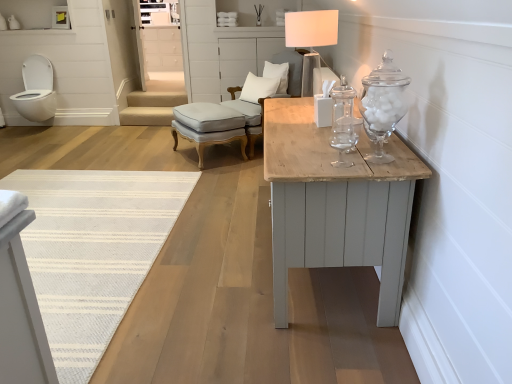
What do you see at coordinates (162, 49) in the screenshot? The image size is (512, 384). I see `white painted wood drawer at upper center` at bounding box center [162, 49].

Locate an element on the screen. This screenshot has width=512, height=384. light gray fabric armchair at center is located at coordinates (229, 128).

The width and height of the screenshot is (512, 384). Describe the element at coordinates (229, 128) in the screenshot. I see `light gray fabric armchair at center` at that location.

This screenshot has height=384, width=512. I want to click on white soft pillow at upper center, marked as the second pillow in a bottom-to-top arrangement, so click(277, 75).

Find the location of a particular element. light gray fabric stool at center is located at coordinates (208, 126).

Is light gray fabric armchair at center bigger or smaller than white fabric lampshade at upper center?

Clearly, light gray fabric armchair at center is larger in size than white fabric lampshade at upper center.

Would you say light gray fabric armchair at center is a long distance from white fabric lampshade at upper center?

light gray fabric armchair at center is positioned a significant distance from white fabric lampshade at upper center.

Considering the positions of objects light gray fabric armchair at center and white fabric lampshade at upper center in the image provided, who is more to the right, light gray fabric armchair at center or white fabric lampshade at upper center?

white fabric lampshade at upper center.

Is point (180, 113) closer or farther from the camera than point (300, 34)?

Point (180, 113).

Looking at this image, are white painted wood drawer at upper center and white glossy toilet at left far apart?

Yes, white painted wood drawer at upper center is far from white glossy toilet at left.

Is white painted wood drawer at upper center facing away from white glossy toilet at left?

No.

Consider the image. Does white painted wood drawer at upper center have a smaller size compared to white glossy toilet at left?

No.

From a real-world perspective, is white painted wood drawer at upper center beneath white glossy toilet at left?

No.

Do you think white painted wood drawer at upper center is within white cotton pillow at upper center, which is counted as the second pillow, starting from the top, or outside of it?

white painted wood drawer at upper center is not enclosed by white cotton pillow at upper center, which is counted as the second pillow, starting from the top.

Which of these two, white painted wood drawer at upper center or white cotton pillow at upper center, which is counted as the second pillow, starting from the top, is wider?

white painted wood drawer at upper center is wider.

Is point (170, 56) positioned before point (272, 84)?

No, (170, 56) is behind (272, 84).

Is white painted wood drawer at upper center bigger than white cotton pillow at upper center, which is counted as the second pillow, starting from the top?

Indeed, white painted wood drawer at upper center has a larger size compared to white cotton pillow at upper center, which is counted as the second pillow, starting from the top.

Can you tell me how much white painted wood dresser at upper center and white glossy toilet at left differ in facing direction?

There is a 178-degree angle between the facing directions of white painted wood dresser at upper center and white glossy toilet at left.

Does white painted wood dresser at upper center have a smaller size compared to white glossy toilet at left?

Correct, white painted wood dresser at upper center occupies less space than white glossy toilet at left.

Considering the positions of objects white painted wood dresser at upper center and white glossy toilet at left in the image provided, who is in front, white painted wood dresser at upper center or white glossy toilet at left?

Positioned in front is white glossy toilet at left.

Which of these two, white painted wood dresser at upper center or white glossy toilet at left, is wider?

white glossy toilet at left is wider.

Which of these two, light gray fabric stool at center or white glossy toilet at left, is smaller?

Smaller between the two is white glossy toilet at left.

The width and height of the screenshot is (512, 384). I want to click on toilet that appears behind the light gray fabric stool at center, so click(36, 90).

Is light gray fabric stool at center positioned behind white glossy toilet at left?

No, light gray fabric stool at center is in front of white glossy toilet at left.

Considering the sizes of objects light gray fabric stool at center and white glossy toilet at left in the image provided, who is thinner, light gray fabric stool at center or white glossy toilet at left?

light gray fabric stool at center.

Is light gray fabric armchair at center not within clear glass jar at center?

Indeed, light gray fabric armchair at center is completely outside clear glass jar at center.

From a real-world perspective, between light gray fabric armchair at center and clear glass jar at center, who is vertically higher?

In real-world perspective, clear glass jar at center is above.

Can you confirm if light gray fabric armchair at center is thinner than clear glass jar at center?

No.

Which of these two, light gray fabric armchair at center or clear glass jar at center, stands shorter?

With less height is clear glass jar at center.

Who is taller, light gray fabric stool at center or white fabric lampshade at upper center?

With more height is white fabric lampshade at upper center.

Does light gray fabric stool at center touch white fabric lampshade at upper center?

No, light gray fabric stool at center is not touching white fabric lampshade at upper center.

From a real-world perspective, does light gray fabric stool at center sit lower than white fabric lampshade at upper center?

Correct, in the physical world, light gray fabric stool at center is lower than white fabric lampshade at upper center.

Where is `armchair located above the white fabric lampshade at upper center (from the image's perspective)`? armchair located above the white fabric lampshade at upper center (from the image's perspective) is located at coordinates (229, 128).

Find the location of a particular element. This screenshot has height=384, width=512. drawer positioned vertically above the white glossy toilet at left (from a real-world perspective) is located at coordinates (162, 49).

From the picture: From the image, which object appears to be farther from white cotton pillow at upper center, marked as the 1th pillow in a bottom-to-top arrangement, white glossy toilet at left or light gray fabric stool at center?

Based on the image, white glossy toilet at left appears to be further to white cotton pillow at upper center, marked as the 1th pillow in a bottom-to-top arrangement.

Considering their positions, is white painted wood drawer at upper center positioned further to light gray fabric stool at center than clear glass jar at center?

clear glass jar at center is further to light gray fabric stool at center.

From the picture: From the image, which object appears to be nearer to light gray fabric stool at center, light gray fabric armchair at center or white glossy toilet at left?

light gray fabric armchair at center lies closer to light gray fabric stool at center than the other object.

Looking at the image, which one is located closer to white cotton pillow at upper center, which is counted as the second pillow, starting from the top, white painted wood drawer at upper center or light gray fabric stool at center?

Based on the image, light gray fabric stool at center appears to be nearer to white cotton pillow at upper center, which is counted as the second pillow, starting from the top.

Which object lies nearer to the anchor point white painted wood drawer at upper center, white cotton pillow at upper center, marked as the 1th pillow in a bottom-to-top arrangement, or clear glass jar at center?

Among the two, white cotton pillow at upper center, marked as the 1th pillow in a bottom-to-top arrangement, is located nearer to white painted wood drawer at upper center.

Consider the image. From the image, which object appears to be farther from white cotton pillow at upper center, marked as the 1th pillow in a bottom-to-top arrangement, clear glass jar at center or light gray fabric stool at center?

The object further to white cotton pillow at upper center, marked as the 1th pillow in a bottom-to-top arrangement, is clear glass jar at center.

Which object lies further to the anchor point white fabric lampshade at upper center, white painted wood drawer at upper center or light gray fabric stool at center?

The object further to white fabric lampshade at upper center is white painted wood drawer at upper center.

Which object lies nearer to the anchor point white painted wood dresser at upper center, white glossy toilet at left or white cotton pillow at upper center, marked as the 1th pillow in a bottom-to-top arrangement?

white glossy toilet at left is closer to white painted wood dresser at upper center.

Identify the location of armchair between white fabric lampshade at upper center and white cotton pillow at upper center, marked as the 1th pillow in a bottom-to-top arrangement, from front to back. This screenshot has width=512, height=384. (229, 128).

Identify the location of armchair between clear glass jar at center and white cotton pillow at upper center, which is counted as the second pillow, starting from the top, in the front-back direction. Image resolution: width=512 pixels, height=384 pixels. 229,128.

This screenshot has height=384, width=512. Identify the location of toilet positioned between light gray fabric armchair at center and white painted wood drawer at upper center from near to far. (36, 90).

In order to click on dresser between light gray fabric armchair at center and white painted wood drawer at upper center from front to back in this screenshot , I will do `click(157, 38)`.